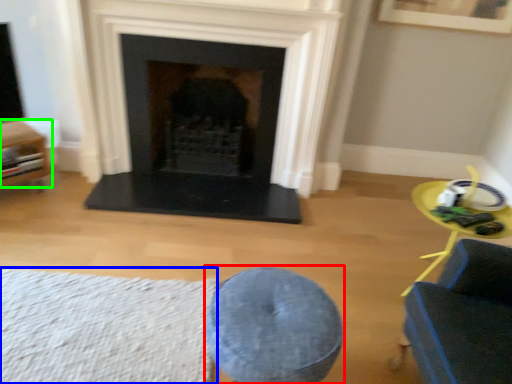
Question: Which is farther away from bar stool (highlighted by a red box)? plain (highlighted by a blue box) or furniture (highlighted by a green box)?

Choices:
 (A) plain
 (B) furniture

Answer: (B)